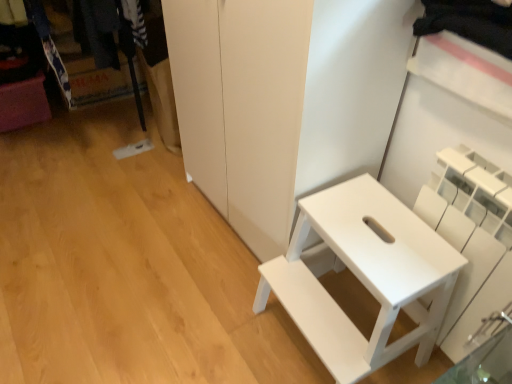
The image size is (512, 384). I want to click on white matte step stool at right, so click(364, 276).

What do you see at coordinates (364, 276) in the screenshot?
I see `white matte step stool at right` at bounding box center [364, 276].

Image resolution: width=512 pixels, height=384 pixels. Describe the element at coordinates (471, 238) in the screenshot. I see `white matte shelf at right` at that location.

The height and width of the screenshot is (384, 512). Identify the location of white matte shelf at right. (471, 238).

In order to face white matte shelf at right, should I rotate leftwards or rightwards?

A 26.141 degree turn to the right will do.

This screenshot has width=512, height=384. I want to click on white matte step stool at right, so point(364,276).

Considering the positions of objects white matte step stool at right and white matte shelf at right in the image provided, who is more to the left, white matte step stool at right or white matte shelf at right?

Positioned to the left is white matte step stool at right.

Considering the relative positions of white matte step stool at right and white matte shelf at right in the image provided, is white matte step stool at right behind white matte shelf at right?

Yes, white matte step stool at right is further from the camera.

Is point (446, 269) closer to camera compared to point (487, 182)?

No, (446, 269) is further to viewer.

Looking at this image, from the image's perspective, is white matte step stool at right above or below white matte shelf at right?

white matte step stool at right is situated lower than white matte shelf at right in the image.

From a real-world perspective, is white matte step stool at right below white matte shelf at right?

Correct, in the physical world, white matte step stool at right is lower than white matte shelf at right.

Which of these two, white matte step stool at right or white matte shelf at right, is thinner?

white matte shelf at right is thinner.

Between white matte step stool at right and white matte shelf at right, which one has less height?

white matte step stool at right.

Considering the relative sizes of white matte step stool at right and white matte shelf at right in the image provided, is white matte step stool at right smaller than white matte shelf at right?

No, white matte step stool at right is not smaller than white matte shelf at right.

Would you say white matte step stool at right is outside white matte shelf at right?

white matte step stool at right is positioned outside white matte shelf at right.

Is white matte step stool at right far away from white matte shelf at right?

No, white matte step stool at right is in close proximity to white matte shelf at right.

Is white matte step stool at right looking in the opposite direction of white matte shelf at right?

Correct, white matte step stool at right is looking away from white matte shelf at right.

Can you tell me how much white matte step stool at right and white matte shelf at right differ in facing direction?

The facing directions of white matte step stool at right and white matte shelf at right are 1.16 degrees apart.

I want to click on shelf on the right of white matte step stool at right, so click(471, 238).

Considering the positions of objects white matte shelf at right and white matte step stool at right in the image provided, who is more to the left, white matte shelf at right or white matte step stool at right?

white matte step stool at right.

Considering the positions of objects white matte shelf at right and white matte step stool at right in the image provided, who is behind, white matte shelf at right or white matte step stool at right?

Positioned behind is white matte step stool at right.

Between point (508, 260) and point (410, 306), which one is positioned behind?

The point (410, 306) is farther from the camera.

From the image's perspective, does white matte shelf at right appear lower than white matte step stool at right?

No, from the image's perspective, white matte shelf at right is not below white matte step stool at right.

From a real-world perspective, is white matte shelf at right below white matte step stool at right?

No, from a real-world perspective, white matte shelf at right is not below white matte step stool at right.

Considering the sizes of objects white matte shelf at right and white matte step stool at right in the image provided, who is thinner, white matte shelf at right or white matte step stool at right?

white matte shelf at right is thinner.

Between white matte shelf at right and white matte step stool at right, which one has more height?

white matte shelf at right is taller.

Considering the sizes of white matte shelf at right and white matte step stool at right in the image, is white matte shelf at right bigger or smaller than white matte step stool at right?

Considering their sizes, white matte shelf at right takes up less space than white matte step stool at right.

Is white matte shelf at right spatially inside white matte step stool at right, or outside of it?

white matte shelf at right exists outside the volume of white matte step stool at right.

Is white matte shelf at right in contact with white matte step stool at right?

white matte shelf at right is not next to white matte step stool at right, and they're not touching.

Is white matte shelf at right oriented towards white matte step stool at right?

Yes.

Locate an element on the screen. The image size is (512, 384). furniture behind the white matte shelf at right is located at coordinates (364, 276).

You are a GUI agent. You are given a task and a screenshot of the screen. Output one action in this format:
    pyautogui.click(x=<x>, y=<y>)
    Task: Click on the shelf that is above the white matte step stool at right (from the image's perspective)
    
    Given the screenshot: What is the action you would take?
    pyautogui.click(x=471, y=238)

Where is `furniture beneath the white matte shelf at right (from a real-world perspective)`? The image size is (512, 384). furniture beneath the white matte shelf at right (from a real-world perspective) is located at coordinates (364, 276).